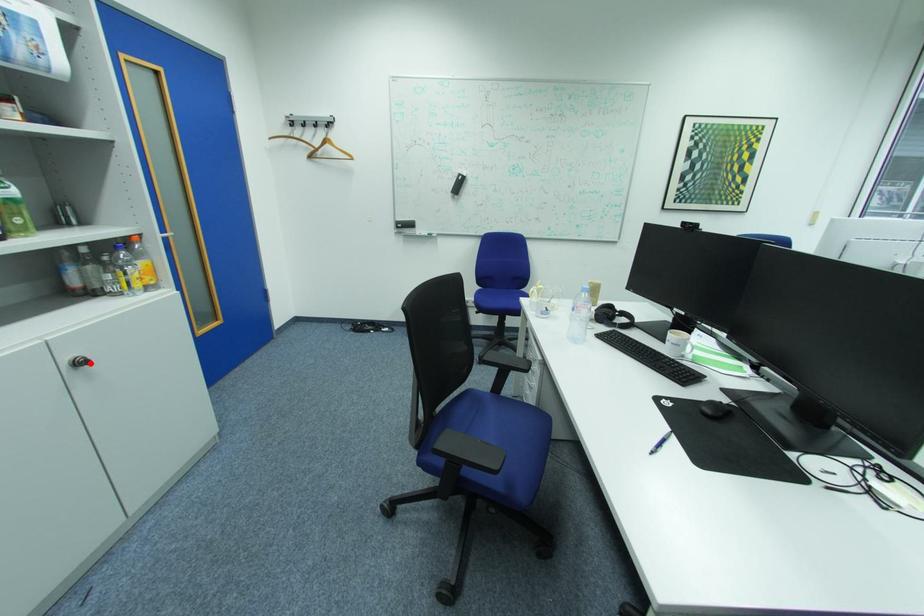
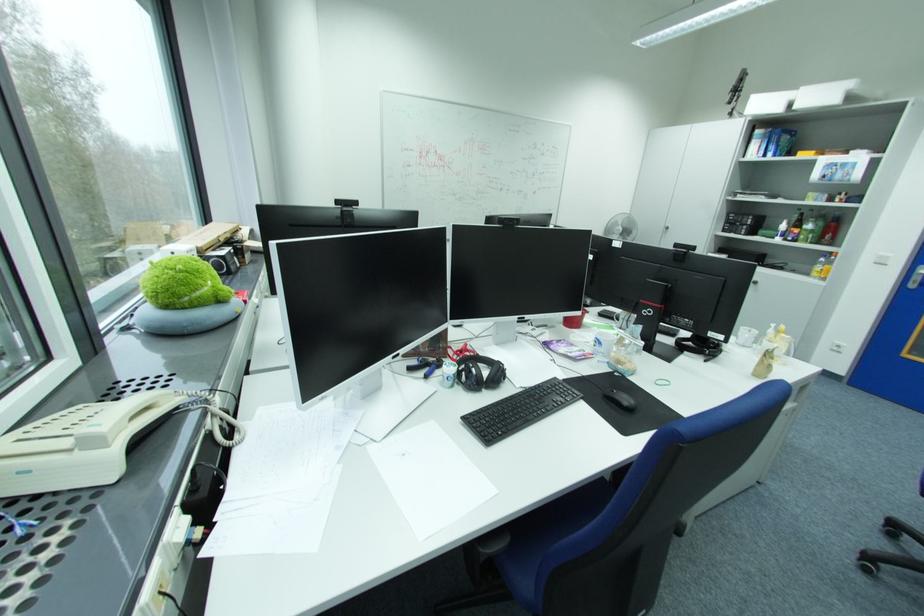
Locate, in the second image, the point that corresponds to the highlighted location in the first image.

(763, 283)